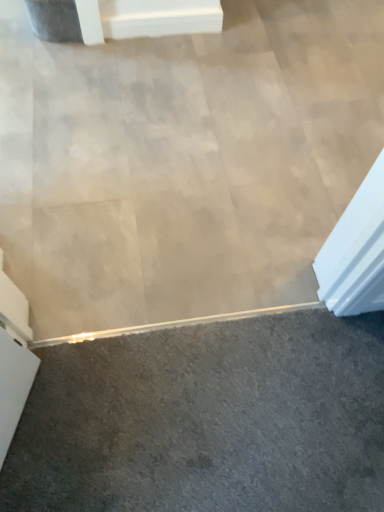
What is the approximate width of gray carpet at bottom?

gray carpet at bottom is 3.63 feet in width.

The image size is (384, 512). Describe the element at coordinates (207, 419) in the screenshot. I see `gray carpet at bottom` at that location.

In order to face gray carpet at bottom, should I rotate leftwards or rightwards?

A 2.877 degree turn to the right will do.

The width and height of the screenshot is (384, 512). Find the location of `gray carpet at bottom`. gray carpet at bottom is located at coordinates (207, 419).

Find the location of `gray carpet at bottom`. gray carpet at bottom is located at coordinates (207, 419).